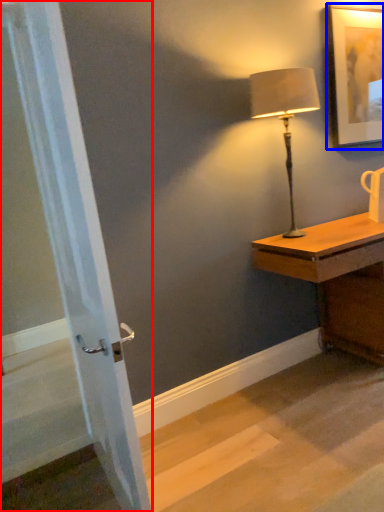
Question: Which object appears closest to the camera in this image, screen door (highlighted by a red box) or picture frame (highlighted by a blue box)?

Choices:
 (A) screen door
 (B) picture frame

Answer: (A)